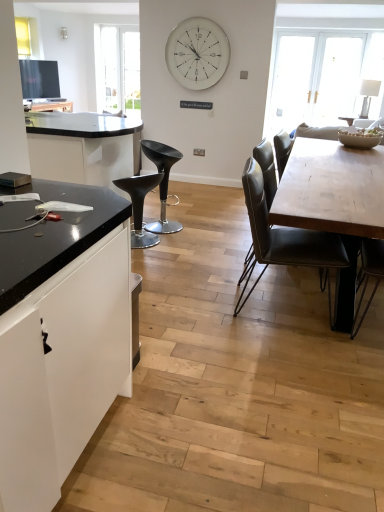
In order to click on vacant space situated above black matte cabinet at left (from a real-world perspective) in this screenshot , I will do `click(48, 213)`.